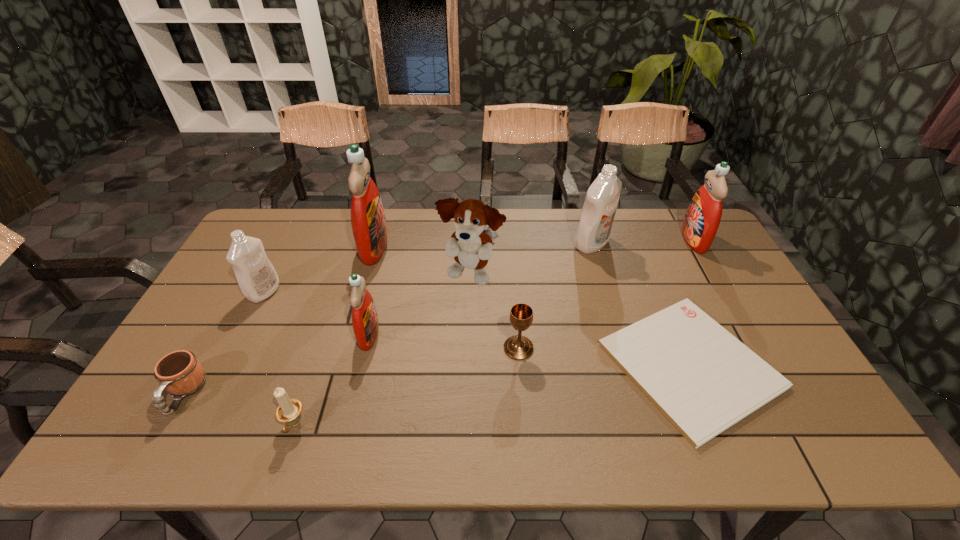
Image resolution: width=960 pixels, height=540 pixels. In order to click on vacant area that lies between the tallest detergent and the mug in this screenshot , I will do `click(279, 320)`.

Identify the location of free area in between the right white detergent and the brown puppy. (531, 260).

Find the location of a particular element. Image resolution: width=960 pixels, height=540 pixels. empty space between the rightmost detergent and the nearest red detergent is located at coordinates (531, 287).

This screenshot has height=540, width=960. I want to click on free space between the candle_holder and the chalice, so click(x=406, y=387).

This screenshot has width=960, height=540. Find the location of `free space that is in between the candle_holder and the brown puppy`. free space that is in between the candle_holder and the brown puppy is located at coordinates (383, 350).

Where is `vacant point located between the shortest object and the candle_holder`? The width and height of the screenshot is (960, 540). vacant point located between the shortest object and the candle_holder is located at coordinates click(x=492, y=395).

You are a GUI agent. You are given a task and a screenshot of the screen. Output one action in this format:
    pyautogui.click(x=<x>, y=<y>)
    Task: Click on the unoccupied position between the mug and the candle_holder
    The width and height of the screenshot is (960, 540).
    Given the screenshot: What is the action you would take?
    pyautogui.click(x=239, y=409)

Locate an element on the screen. vacant space in between the candle_holder and the bigger white detergent is located at coordinates pos(443,334).

Where is `unoccupied position between the nearest detergent and the rightmost detergent`? This screenshot has width=960, height=540. unoccupied position between the nearest detergent and the rightmost detergent is located at coordinates coord(531,287).

Locate which object is the second closest to the brown puppy. Please provide its 2D coordinates. Your answer should be formatted as a tuple, i.e. [(x, y)], where the tuple contains the x and y coordinates of a point satisfying the conditions above.

[(365, 323)]